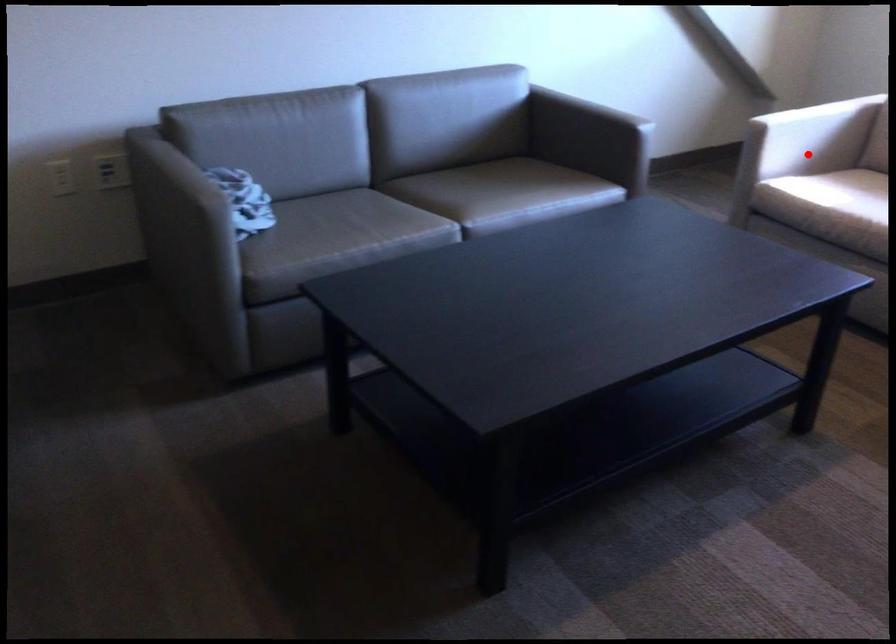
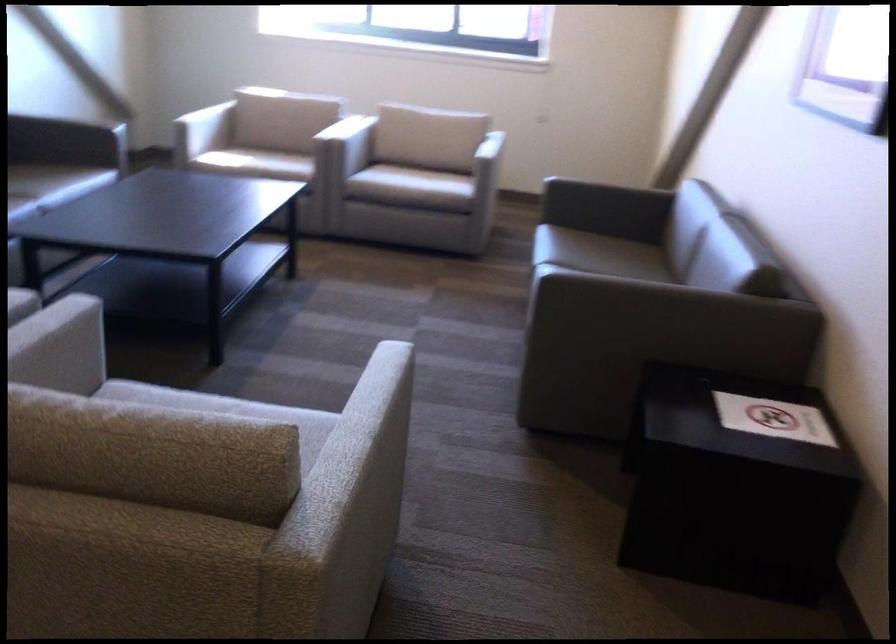
Where in the second image is the point corresponding to the highlighted location from the first image?

(202, 131)